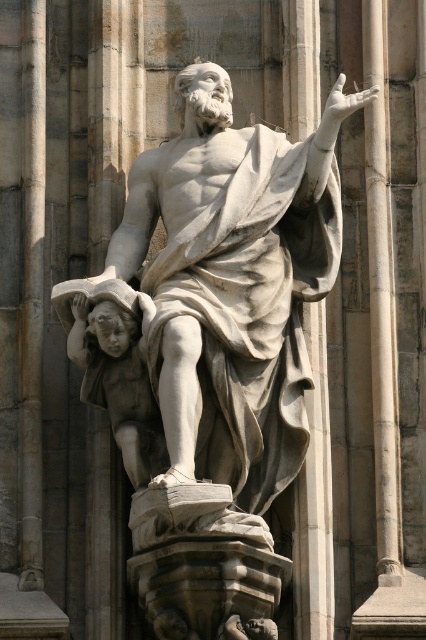
Question: Which point is closer to the camera?

Choices:
 (A) (313, 353)
 (B) (175, 461)
 (C) (160, 451)

Answer: (B)

Question: Can you confirm if white marble statue at center is thinner than smooth gray cherub at lower left?

Choices:
 (A) no
 (B) yes

Answer: (A)

Question: Is white marble pillar at center above smooth gray cherub at lower left?

Choices:
 (A) no
 (B) yes

Answer: (B)

Question: Which of the following is the closest to the observer?

Choices:
 (A) white marble pillar at center
 (B) smooth gray cherub at lower left
 (C) white marble statue at center

Answer: (C)

Question: Can you confirm if white marble pillar at center is positioned below smooth gray cherub at lower left?

Choices:
 (A) no
 (B) yes

Answer: (A)

Question: Estimate the real-world distances between objects in this image. Which object is farther from the white marble statue at center?

Choices:
 (A) white marble pillar at center
 (B) smooth gray cherub at lower left

Answer: (B)